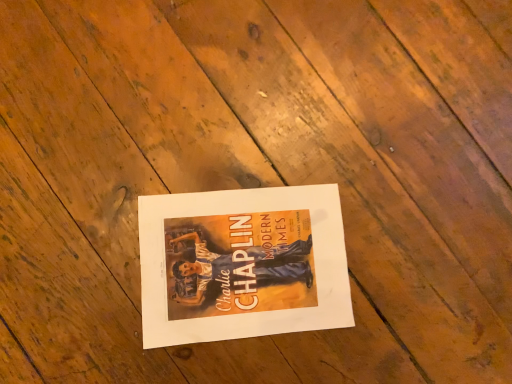
I want to click on vacant area on top of matte paper poster at center (from a real-world perspective), so click(239, 260).